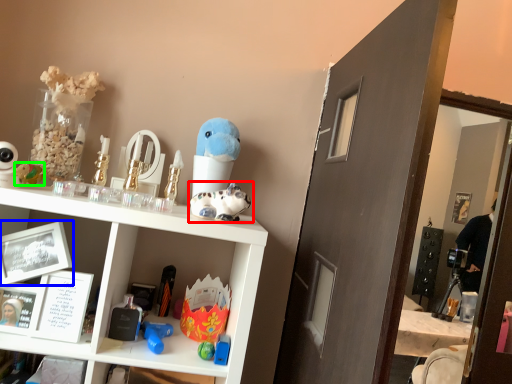
Question: Considering the real-world distances, which object is farthest from toy (highlighted by a red box)? picture frame (highlighted by a blue box) or toy (highlighted by a green box)?

Choices:
 (A) picture frame
 (B) toy

Answer: (B)